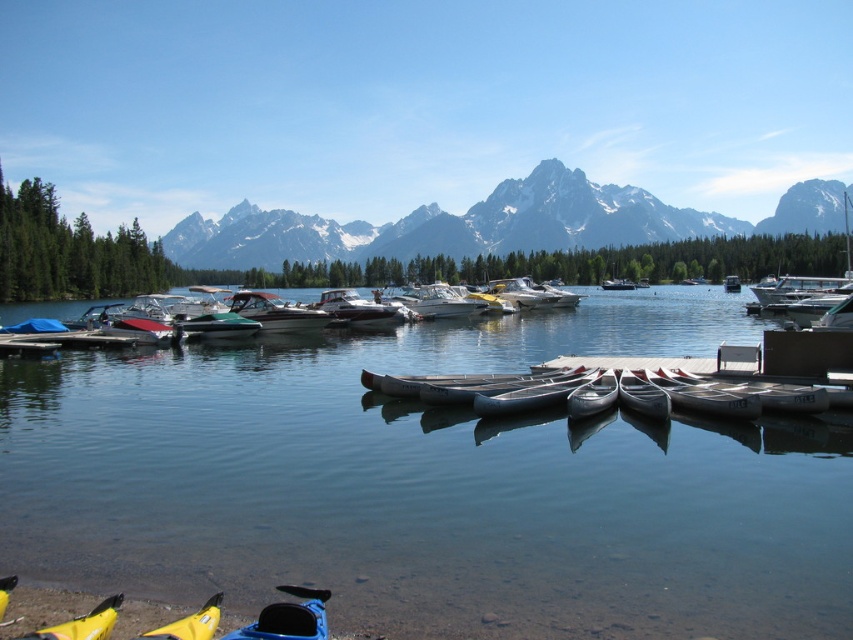
Question: From the image, what is the correct spatial relationship of yellow matte kayak at lower left in relation to metallic silver canoe at center?

Choices:
 (A) right
 (B) left

Answer: (B)

Question: Among these objects, which one is nearest to the camera?

Choices:
 (A) white plastic canoe at center
 (B) snowy granite mountain range at upper center

Answer: (A)

Question: Considering the real-world distances, which object is farthest from the metallic silver canoe at center?

Choices:
 (A) blue plastic canoe at lower left
 (B) yellow matte kayak at lower left
 (C) white plastic canoe at center
 (D) snowy granite mountain range at upper center

Answer: (D)

Question: Can you confirm if blue plastic canoe at lower left is positioned above white glossy boat at center?

Choices:
 (A) yes
 (B) no

Answer: (B)

Question: Is blue plastic canoe at lower left thinner than white plastic canoe at center?

Choices:
 (A) yes
 (B) no

Answer: (A)

Question: Which point appears closest to the camera in this image?

Choices:
 (A) (764, 483)
 (B) (605, 284)

Answer: (A)